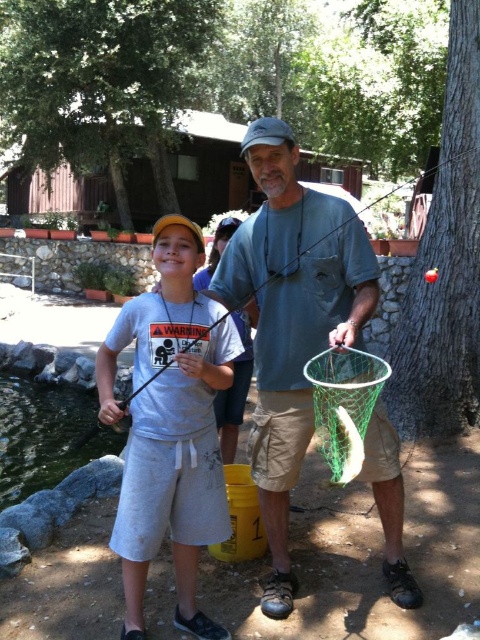
Can you confirm if gray cotton t-shirt at center is positioned to the left of green mesh fishing net at center?

Yes, gray cotton t-shirt at center is to the left of green mesh fishing net at center.

Can you confirm if gray cotton t-shirt at center is positioned to the right of green mesh fishing net at center?

Incorrect, gray cotton t-shirt at center is not on the right side of green mesh fishing net at center.

What do you see at coordinates (169, 426) in the screenshot? I see `gray cotton t-shirt at center` at bounding box center [169, 426].

Where is `gray cotton t-shirt at center`? gray cotton t-shirt at center is located at coordinates (169, 426).

Looking at this image, can you confirm if green mesh fishing net at center is smaller than white matte fish at center?

Incorrect, green mesh fishing net at center is not smaller in size than white matte fish at center.

From the picture: Is green mesh fishing net at center wider than white matte fish at center?

Correct, the width of green mesh fishing net at center exceeds that of white matte fish at center.

Is point (351, 397) positioned after point (345, 477)?

No, it is in front of (345, 477).

This screenshot has height=640, width=480. Find the location of `green mesh fishing net at center`. green mesh fishing net at center is located at coordinates (345, 404).

Which of these two, gray cotton t-shirt at center or green mesh net at center, stands shorter?

gray cotton t-shirt at center

Between gray cotton t-shirt at center and green mesh net at center, which one has more height?

green mesh net at center

Does point (144, 483) lie behind point (432, 147)?

No, (144, 483) is in front of (432, 147).

The image size is (480, 640). In order to click on gray cotton t-shirt at center in this screenshot , I will do `click(169, 426)`.